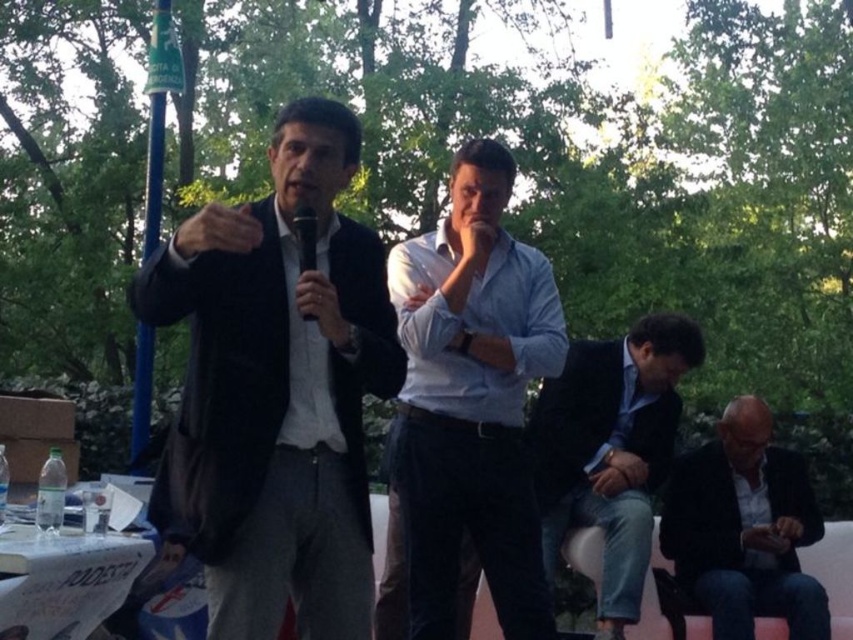
Can you confirm if light blue shirt at center is shorter than dark blue suit at lower right?

In fact, light blue shirt at center may be taller than dark blue suit at lower right.

Locate an element on the screen. The height and width of the screenshot is (640, 853). light blue shirt at center is located at coordinates (468, 406).

Locate an element on the screen. light blue shirt at center is located at coordinates (468, 406).

Looking at this image, does light blue shirt at center have a greater width compared to dark gray suit at lower right?

In fact, light blue shirt at center might be narrower than dark gray suit at lower right.

Between light blue shirt at center and dark gray suit at lower right, which one has more height?

light blue shirt at center

The height and width of the screenshot is (640, 853). I want to click on light blue shirt at center, so click(x=468, y=406).

Based on the photo, between matte black suit at left and dark gray suit at lower right, which one is positioned lower?

dark gray suit at lower right

Is matte black suit at left bigger than dark gray suit at lower right?

Yes.

The image size is (853, 640). Describe the element at coordinates (276, 390) in the screenshot. I see `matte black suit at left` at that location.

Identify the location of matte black suit at left. The image size is (853, 640). (276, 390).